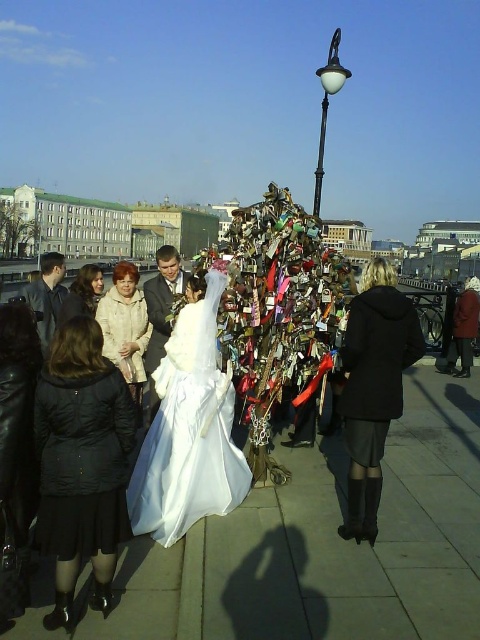
Question: Considering the relative positions of matte beige coat at center and dark gray suit at left in the image provided, where is matte beige coat at center located with respect to dark gray suit at left?

Choices:
 (A) below
 (B) above

Answer: (A)

Question: Which object is positioned farthest from the dark gray suit at left?

Choices:
 (A) black matte coat at center
 (B) white fabric dress at center

Answer: (A)

Question: Among these objects, which one is nearest to the camera?

Choices:
 (A) satin suit at center
 (B) white satin dress at center
 (C) white fabric dress at center
 (D) black matte coat at center

Answer: (C)

Question: Can you confirm if matte beige coat at center is positioned below satin suit at center?

Choices:
 (A) no
 (B) yes

Answer: (B)

Question: Is black matte coat at center to the right of matte black coat at center from the viewer's perspective?

Choices:
 (A) no
 (B) yes

Answer: (B)

Question: Which point appears closest to the camera in this image?

Choices:
 (A) (290, 563)
 (B) (142, 337)

Answer: (A)